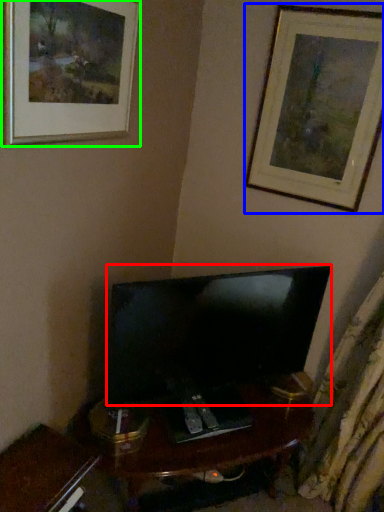
Question: Which object is positioned farthest from television (highlighted by a red box)? Select from picture frame (highlighted by a blue box) and picture frame (highlighted by a green box).

Choices:
 (A) picture frame
 (B) picture frame

Answer: (B)